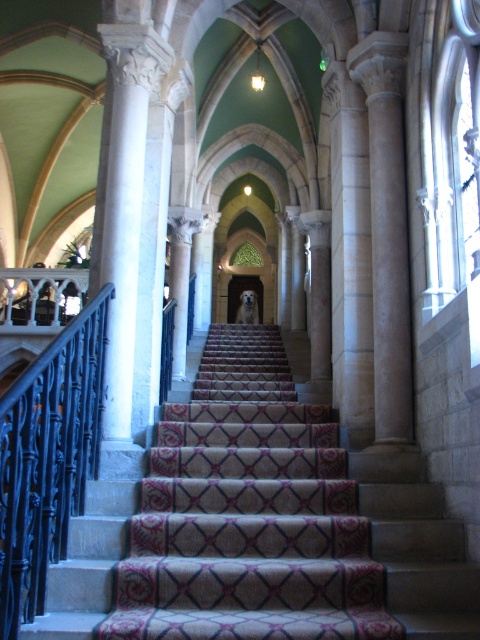
Question: Is carpeted stairs at center further to the viewer compared to black wrought iron railing at left?

Choices:
 (A) no
 (B) yes

Answer: (B)

Question: Which point is closer to the camera?

Choices:
 (A) (96, 404)
 (B) (214, 403)
 (C) (130, 161)
 (D) (394, 300)

Answer: (A)

Question: Is black wrought iron railing at left thinner than beige stone column at center?

Choices:
 (A) no
 (B) yes

Answer: (B)

Question: Does carpeted stairs at center appear over white marble column at center?

Choices:
 (A) no
 (B) yes

Answer: (A)

Question: Which of these objects is positioned closest to the white marble column at center?

Choices:
 (A) carpeted stairs at center
 (B) beige stone column at center

Answer: (B)

Question: Considering the real-world distances, which object is farthest from the white marble column at center?

Choices:
 (A) beige stone column at center
 (B) carpeted stairs at center
 (C) black wrought iron railing at left

Answer: (B)